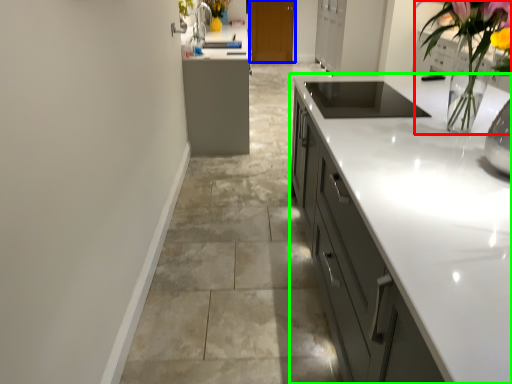
Question: Estimate the real-world distances between objects in this image. Which object is farther from floral arrangement (highlighted by a red box), cabinetry (highlighted by a blue box) or cabinetry (highlighted by a green box)?

Choices:
 (A) cabinetry
 (B) cabinetry

Answer: (A)